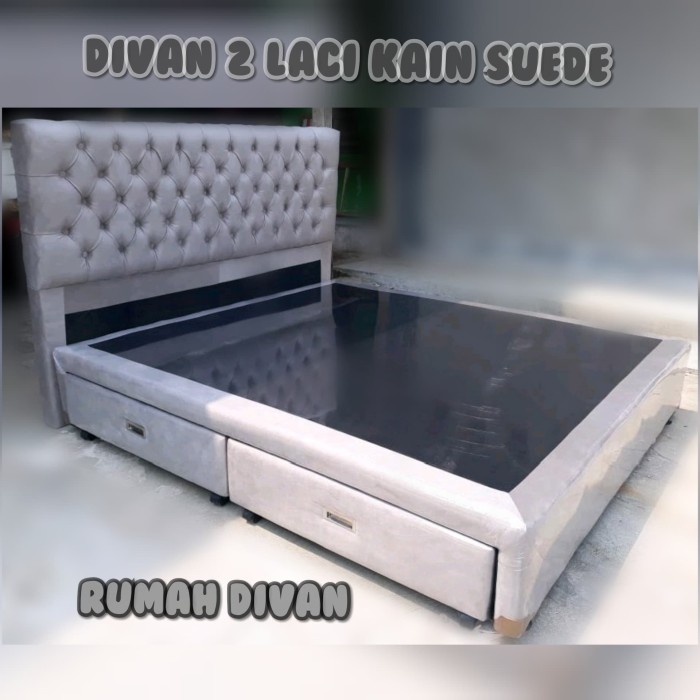
Where is `white carpet`? This screenshot has width=700, height=700. white carpet is located at coordinates (647, 580).